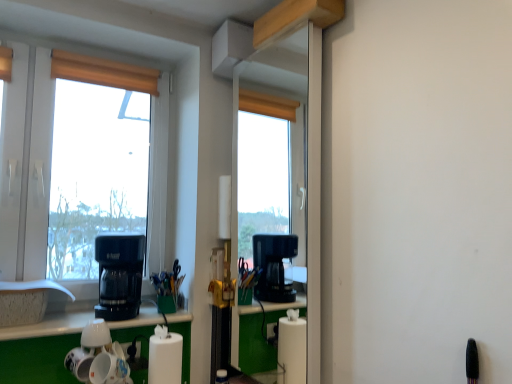
Question: Should I look upward or downward to see white plastic window at left?

Choices:
 (A) up
 (B) down

Answer: (A)

Question: Is white plastic window at left facing towards wooden blind at upper left?

Choices:
 (A) no
 (B) yes

Answer: (B)

Question: Considering the relative sizes of white plastic window at left and wooden blind at upper left in the image provided, is white plastic window at left taller than wooden blind at upper left?

Choices:
 (A) no
 (B) yes

Answer: (B)

Question: Is white plastic window at left positioned beyond the bounds of wooden blind at upper left?

Choices:
 (A) no
 (B) yes

Answer: (B)

Question: From a real-world perspective, is white plastic window at left positioned under wooden blind at upper left based on gravity?

Choices:
 (A) no
 (B) yes

Answer: (B)

Question: Is white plastic window at left positioned before wooden blind at upper left?

Choices:
 (A) yes
 (B) no

Answer: (A)

Question: From the image's perspective, does white plastic window at left appear lower than wooden blind at upper left?

Choices:
 (A) yes
 (B) no

Answer: (A)

Question: Does white plastic window at left lie behind black plastic coffee maker at left?

Choices:
 (A) no
 (B) yes

Answer: (B)

Question: Is white plastic window at left bigger than black plastic coffee maker at left?

Choices:
 (A) yes
 (B) no

Answer: (A)

Question: Is white plastic window at left to the left of black plastic coffee maker at left from the viewer's perspective?

Choices:
 (A) no
 (B) yes

Answer: (B)

Question: Does white plastic window at left have a lesser width compared to black plastic coffee maker at left?

Choices:
 (A) no
 (B) yes

Answer: (B)

Question: From the image's perspective, is white plastic window at left under black plastic coffee maker at left?

Choices:
 (A) yes
 (B) no

Answer: (B)

Question: Is white plastic window at left not within black plastic coffee maker at left?

Choices:
 (A) no
 (B) yes

Answer: (B)

Question: Considering the relative positions of white glossy mugs at lower left and white glossy counter top at lower center in the image provided, is white glossy mugs at lower left to the left of white glossy counter top at lower center from the viewer's perspective?

Choices:
 (A) yes
 (B) no

Answer: (B)